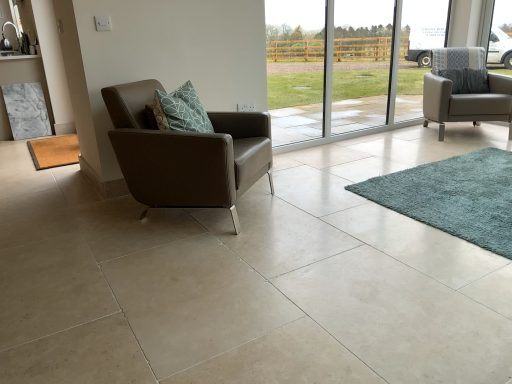
Measure the distance between point (383, 59) and camera.

Point (383, 59) is 7.67 meters from camera.

The height and width of the screenshot is (384, 512). Describe the element at coordinates (453, 197) in the screenshot. I see `teal shaggy rug at lower right, which appears as the 2th mat when viewed from the left` at that location.

This screenshot has width=512, height=384. In order to click on matte gray armchair at right, the first chair positioned from the right in this screenshot , I will do `click(464, 90)`.

Is transparent glass door at center oriented away from brown textured mat at lower left, arranged as the 1th mat when viewed from the left?

No, transparent glass door at center's orientation is not away from brown textured mat at lower left, arranged as the 1th mat when viewed from the left.

From a real-world perspective, is transparent glass door at center beneath brown textured mat at lower left, arranged as the 1th mat when viewed from the left?

No, from a real-world perspective, transparent glass door at center is not below brown textured mat at lower left, arranged as the 1th mat when viewed from the left.

How much distance is there between transparent glass door at center and brown textured mat at lower left, acting as the 2th mat starting from the right?

The distance of transparent glass door at center from brown textured mat at lower left, acting as the 2th mat starting from the right, is 6.05 meters.

Who is taller, transparent glass door at center or brown textured mat at lower left, acting as the 2th mat starting from the right?

Standing taller between the two is transparent glass door at center.

Between transparent glass door at center and teal shaggy rug at lower right, the 2th mat positioned from the back, which one appears on the right side from the viewer's perspective?

Positioned to the right is teal shaggy rug at lower right, the 2th mat positioned from the back.

Which is more distant, (292,126) or (502,245)?

Point (292,126)

Considering the sizes of objects transparent glass door at center and teal shaggy rug at lower right, the first mat positioned from the front, in the image provided, who is shorter, transparent glass door at center or teal shaggy rug at lower right, the first mat positioned from the front,?

teal shaggy rug at lower right, the first mat positioned from the front, is shorter.

Can you confirm if transparent glass door at center is wider than teal shaggy rug at lower right, positioned as the 1th mat in right-to-left order?

No.

From the image's perspective, which is above, teal shaggy rug at lower right, positioned as the 1th mat in right-to-left order, or brown leather armchair at left, which appears as the second chair when viewed from the right?

brown leather armchair at left, which appears as the second chair when viewed from the right, appears higher in the image.

Is teal shaggy rug at lower right, the first mat positioned from the front, turned away from brown leather armchair at left, marked as the 1th chair in a left-to-right arrangement?

No, teal shaggy rug at lower right, the first mat positioned from the front, is not facing the opposite direction of brown leather armchair at left, marked as the 1th chair in a left-to-right arrangement.

Is the position of teal shaggy rug at lower right, positioned as the 1th mat in right-to-left order, less distant than that of brown leather armchair at left, marked as the 1th chair in a left-to-right arrangement?

Yes, teal shaggy rug at lower right, positioned as the 1th mat in right-to-left order, is in front of brown leather armchair at left, marked as the 1th chair in a left-to-right arrangement.

Is teal shaggy rug at lower right, the 2th mat positioned from the back, wider or thinner than brown leather armchair at left, which appears as the second chair when viewed from the right?

In the image, teal shaggy rug at lower right, the 2th mat positioned from the back, appears to be wider than brown leather armchair at left, which appears as the second chair when viewed from the right.

Find the location of a particular element. chair that appears on the right of transparent glass door at center is located at coordinates (464, 90).

From a real-world perspective, is matte gray armchair at right, the first chair positioned from the right, positioned under transparent glass door at center based on gravity?

Yes, from a real-world perspective, matte gray armchair at right, the first chair positioned from the right, is below transparent glass door at center.

Considering the sizes of matte gray armchair at right, the first chair positioned from the right, and transparent glass door at center in the image, is matte gray armchair at right, the first chair positioned from the right, bigger or smaller than transparent glass door at center?

In the image, matte gray armchair at right, the first chair positioned from the right, appears to be larger than transparent glass door at center.

Looking at this image, which object is closer to the camera, brown textured mat at lower left, arranged as the 1th mat when viewed from the left, or brown leather armchair at left, placed as the second chair when sorted from back to front?

brown leather armchair at left, placed as the second chair when sorted from back to front, is more forward.

Is brown textured mat at lower left, acting as the 2th mat starting from the right, thinner than brown leather armchair at left, which appears as the second chair when viewed from the right?

Indeed, brown textured mat at lower left, acting as the 2th mat starting from the right, has a lesser width compared to brown leather armchair at left, which appears as the second chair when viewed from the right.

Which object is positioned more to the left, brown textured mat at lower left, arranged as the 1th mat when viewed from the left, or brown leather armchair at left, marked as the 1th chair in a left-to-right arrangement?

From the viewer's perspective, brown textured mat at lower left, arranged as the 1th mat when viewed from the left, appears more on the left side.

In the scene shown: Is brown leather armchair at left, placed as the second chair when sorted from back to front, surrounded by brown textured mat at lower left, marked as the 1th mat in a back-to-front arrangement?

No, brown leather armchair at left, placed as the second chair when sorted from back to front, is located outside of brown textured mat at lower left, marked as the 1th mat in a back-to-front arrangement.

Can you tell me how much teal shaggy rug at lower right, which appears as the 2th mat when viewed from the left, and transparent glass door at center differ in facing direction?

There is a 90.1-degree angle between the facing directions of teal shaggy rug at lower right, which appears as the 2th mat when viewed from the left, and transparent glass door at center.

Between teal shaggy rug at lower right, the first mat positioned from the front, and transparent glass door at center, which one has more height?

→ transparent glass door at center.

Is teal shaggy rug at lower right, the 2th mat positioned from the back, positioned with its back to transparent glass door at center?

No, teal shaggy rug at lower right, the 2th mat positioned from the back, is not facing the opposite direction of transparent glass door at center.

Consider the image. From the image's perspective, is teal shaggy rug at lower right, the first mat positioned from the front, located above or below transparent glass door at center?

teal shaggy rug at lower right, the first mat positioned from the front, is situated lower than transparent glass door at center in the image.

Is matte gray armchair at right, the first chair positioned from the right, looking in the opposite direction of brown textured mat at lower left, acting as the 2th mat starting from the right?

No, brown textured mat at lower left, acting as the 2th mat starting from the right, is not at the back of matte gray armchair at right, the first chair positioned from the right.

Identify the location of chair located above the brown textured mat at lower left, arranged as the 1th mat when viewed from the left (from the image's perspective). (464, 90).

From a real-world perspective, which is physically above, matte gray armchair at right, acting as the second chair starting from the left, or brown textured mat at lower left, arranged as the 1th mat when viewed from the left?

matte gray armchair at right, acting as the second chair starting from the left.

From the image's perspective, which one is positioned higher, matte gray armchair at right, the first chair positioned from the right, or brown textured mat at lower left, marked as the 1th mat in a back-to-front arrangement?

From the image's view, matte gray armchair at right, the first chair positioned from the right, is above.

Where is `glass door in front of the brown textured mat at lower left, the second mat positioned from the front`? Image resolution: width=512 pixels, height=384 pixels. glass door in front of the brown textured mat at lower left, the second mat positioned from the front is located at coordinates (349, 71).

Locate an element on the screen. glass door that appears above the teal shaggy rug at lower right, positioned as the 1th mat in right-to-left order (from a real-world perspective) is located at coordinates (349, 71).

Which object lies nearer to the anchor point teal shaggy rug at lower right, which appears as the 2th mat when viewed from the left, brown leather armchair at left, marked as the 1th chair in a left-to-right arrangement, or transparent glass door at center?

brown leather armchair at left, marked as the 1th chair in a left-to-right arrangement, is closer to teal shaggy rug at lower right, which appears as the 2th mat when viewed from the left.

Based on their spatial positions, is brown textured mat at lower left, arranged as the 1th mat when viewed from the left, or matte gray armchair at right, the 2th chair positioned from the front, further from teal shaggy rug at lower right, which appears as the 2th mat when viewed from the left?

Based on the image, brown textured mat at lower left, arranged as the 1th mat when viewed from the left, appears to be further to teal shaggy rug at lower right, which appears as the 2th mat when viewed from the left.

When comparing their distances from matte gray armchair at right, the first chair positioned from the right, does teal shaggy rug at lower right, positioned as the 1th mat in right-to-left order, or brown leather armchair at left, positioned as the 1th chair in front-to-back order, seem closer?

teal shaggy rug at lower right, positioned as the 1th mat in right-to-left order, lies closer to matte gray armchair at right, the first chair positioned from the right, than the other object.

Estimate the real-world distances between objects in this image. Which object is closer to brown textured mat at lower left, marked as the 1th mat in a back-to-front arrangement, teal shaggy rug at lower right, the 2th mat positioned from the back, or matte gray armchair at right, the 2th chair positioned from the front?

teal shaggy rug at lower right, the 2th mat positioned from the back.

Estimate the real-world distances between objects in this image. Which object is further from brown textured mat at lower left, arranged as the 1th mat when viewed from the left, matte gray armchair at right, the 2th chair positioned from the front, or transparent glass door at center?

The object further to brown textured mat at lower left, arranged as the 1th mat when viewed from the left, is transparent glass door at center.

From the picture: Which object lies further to the anchor point teal shaggy rug at lower right, the first mat positioned from the front, brown textured mat at lower left, acting as the 2th mat starting from the right, or brown leather armchair at left, placed as the second chair when sorted from back to front?

Among the two, brown textured mat at lower left, acting as the 2th mat starting from the right, is located further to teal shaggy rug at lower right, the first mat positioned from the front.

Considering their positions, is transparent glass door at center positioned further to brown textured mat at lower left, the second mat positioned from the front, than teal shaggy rug at lower right, which appears as the 2th mat when viewed from the left?

transparent glass door at center is further to brown textured mat at lower left, the second mat positioned from the front.

Consider the image. Which object lies nearer to the anchor point matte gray armchair at right, placed as the 1th chair when sorted from back to front, transparent glass door at center or brown textured mat at lower left, acting as the 2th mat starting from the right?

transparent glass door at center lies closer to matte gray armchair at right, placed as the 1th chair when sorted from back to front, than the other object.

Where is `glass door between brown textured mat at lower left, marked as the 1th mat in a back-to-front arrangement, and teal shaggy rug at lower right, positioned as the 1th mat in right-to-left order`? The height and width of the screenshot is (384, 512). glass door between brown textured mat at lower left, marked as the 1th mat in a back-to-front arrangement, and teal shaggy rug at lower right, positioned as the 1th mat in right-to-left order is located at coordinates (349, 71).

Identify the location of glass door between brown textured mat at lower left, the second mat positioned from the front, and matte gray armchair at right, placed as the 1th chair when sorted from back to front, in the horizontal direction. (349, 71).

At what (x,y) coordinates should I click in order to perform the action: click on mat between brown textured mat at lower left, the second mat positioned from the front, and matte gray armchair at right, the first chair positioned from the right. Please return your answer as a coordinate pair (x, y). Looking at the image, I should click on (453, 197).

What are the coordinates of `glass door located between brown leather armchair at left, marked as the 1th chair in a left-to-right arrangement, and matte gray armchair at right, the first chair positioned from the right, in the left-right direction` in the screenshot? It's located at (349, 71).